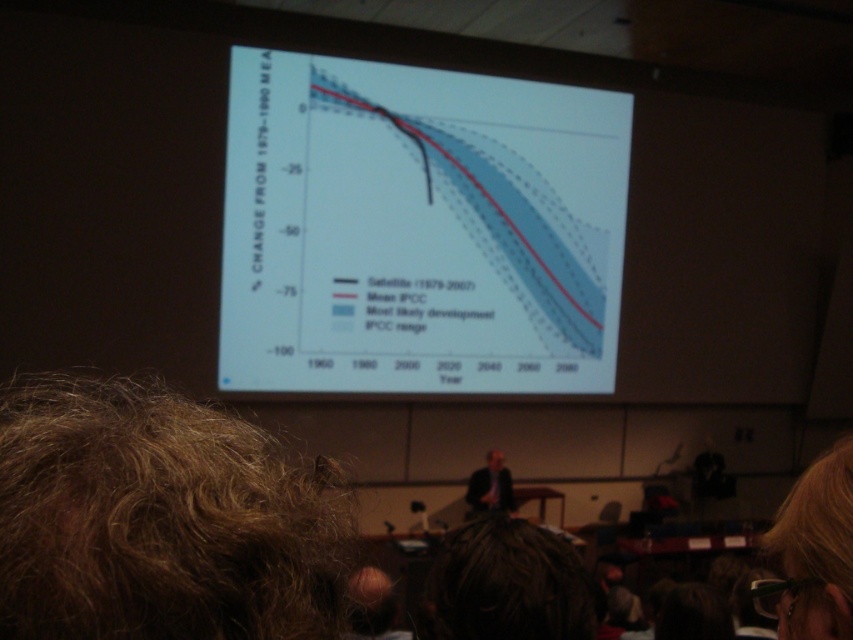
Does dark brown hair at center have a smaller size compared to dark suit at center?

Correct, dark brown hair at center occupies less space than dark suit at center.

The width and height of the screenshot is (853, 640). I want to click on dark brown hair at center, so click(x=506, y=584).

Who is positioned more to the left, brown curly hair at lower left or dark brown hair at center?

From the viewer's perspective, brown curly hair at lower left appears more on the left side.

Which of these two, brown curly hair at lower left or dark brown hair at center, stands taller?

Standing taller between the two is brown curly hair at lower left.

The image size is (853, 640). Describe the element at coordinates (160, 520) in the screenshot. I see `brown curly hair at lower left` at that location.

Where is `brown curly hair at lower left`? Image resolution: width=853 pixels, height=640 pixels. brown curly hair at lower left is located at coordinates (160, 520).

Is white paper at center wider than dark brown hair at center?

Correct, the width of white paper at center exceeds that of dark brown hair at center.

Is point (370, 376) more distant than point (447, 570)?

Yes, point (370, 376) is behind point (447, 570).

Identify the location of white paper at center. The image size is (853, 640). (418, 228).